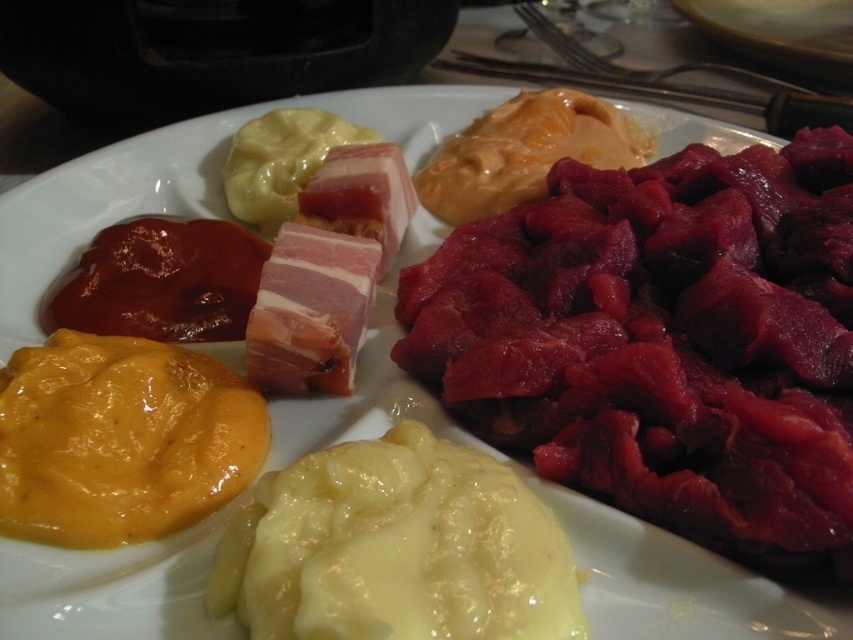
Question: Can you confirm if yellow creamy cheese at lower left is bigger than shiny red sauce at upper left?

Choices:
 (A) no
 (B) yes

Answer: (B)

Question: Which of the following is the farthest from the observer?

Choices:
 (A) (186, 294)
 (B) (45, 362)

Answer: (A)

Question: Is yellow creamy cheese at lower left to the right of shiny red sauce at upper left from the viewer's perspective?

Choices:
 (A) yes
 (B) no

Answer: (A)

Question: Is yellow creamy cheese at lower left positioned before shiny red sauce at upper left?

Choices:
 (A) yes
 (B) no

Answer: (A)

Question: Among these points, which one is farthest from the camera?

Choices:
 (A) (202, 257)
 (B) (201, 476)

Answer: (A)